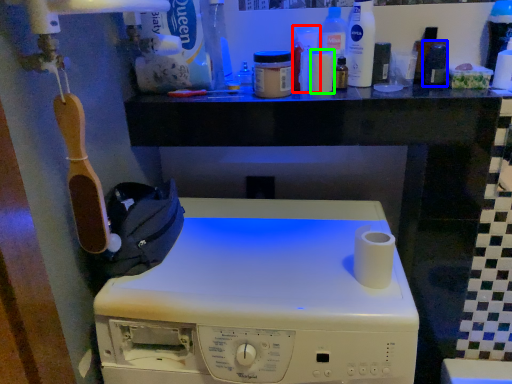
Question: Considering the real-world distances, which object is farthest from toiletry (highlighted by a red box)? toiletry (highlighted by a blue box) or toiletry (highlighted by a green box)?

Choices:
 (A) toiletry
 (B) toiletry

Answer: (A)